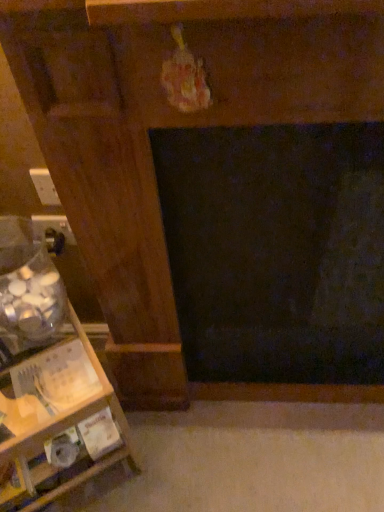
This screenshot has height=512, width=384. In order to click on vacant space to the right of wooden shelf at left in this screenshot , I will do `click(182, 466)`.